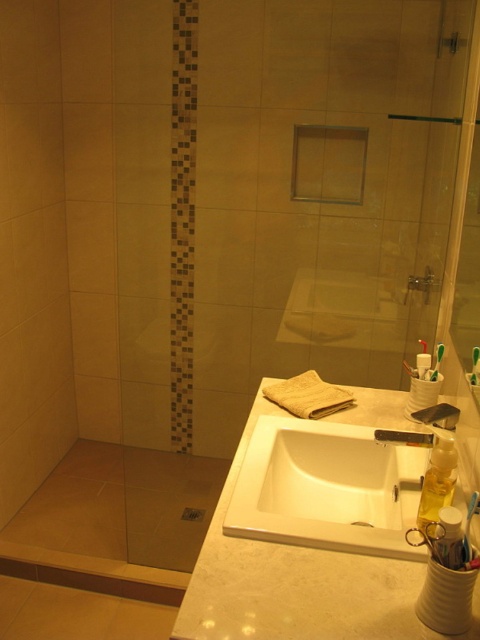
What do you see at coordinates (437, 480) in the screenshot? I see `translucent yellow liquid at sink right` at bounding box center [437, 480].

Which is behind, point (429, 497) or point (383, 433)?

The point (383, 433) is behind.

What do you see at coordinates (437, 480) in the screenshot? I see `translucent yellow liquid at sink right` at bounding box center [437, 480].

Identify the location of translucent yellow liquid at sink right. (437, 480).

Which of these two, white marble sink at center or silver metallic faucet at sink right, stands taller?

white marble sink at center is taller.

Can you confirm if white marble sink at center is wider than silver metallic faucet at sink right?

Yes, white marble sink at center is wider than silver metallic faucet at sink right.

This screenshot has width=480, height=640. I want to click on white marble sink at center, so click(x=297, y=582).

Which is behind, point (369, 508) or point (376, 436)?

Positioned behind is point (369, 508).

Where is `white glossy sink at center`? white glossy sink at center is located at coordinates (326, 488).